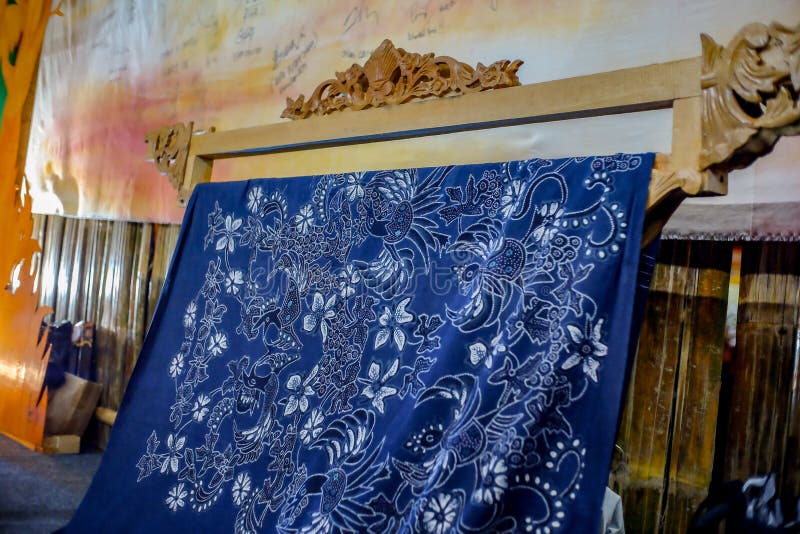
You are a GUI agent. You are given a task and a screenshot of the screen. Output one action in this format:
    pyautogui.click(x=<x>, y=<y>)
    Task: Click on the wood carving
    The height and width of the screenshot is (534, 800).
    Given the screenshot: What is the action you would take?
    pyautogui.click(x=170, y=162), pyautogui.click(x=393, y=74), pyautogui.click(x=760, y=96)